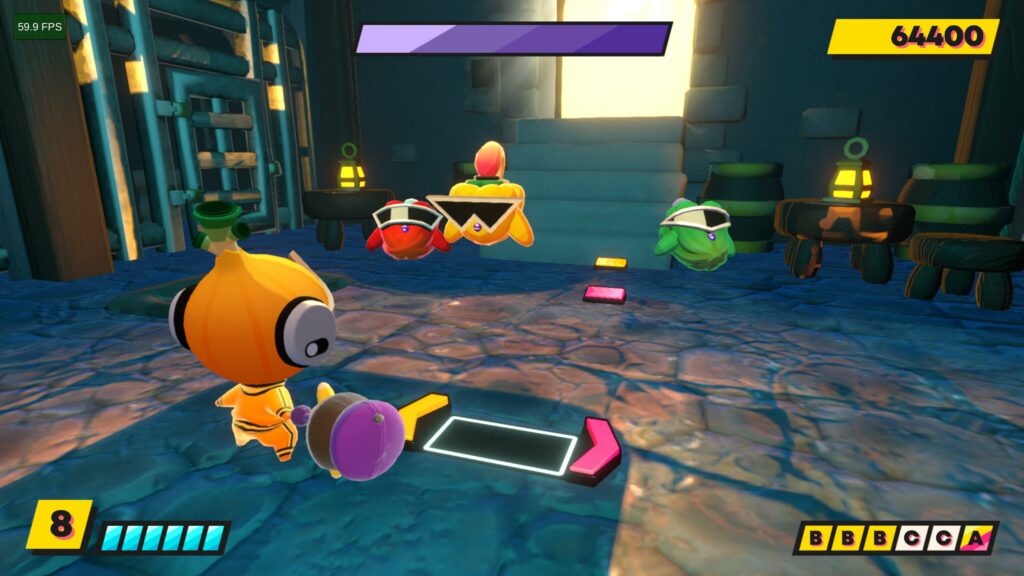
Where is `brick wall`? Image resolution: width=1024 pixels, height=576 pixels. brick wall is located at coordinates (725, 111).